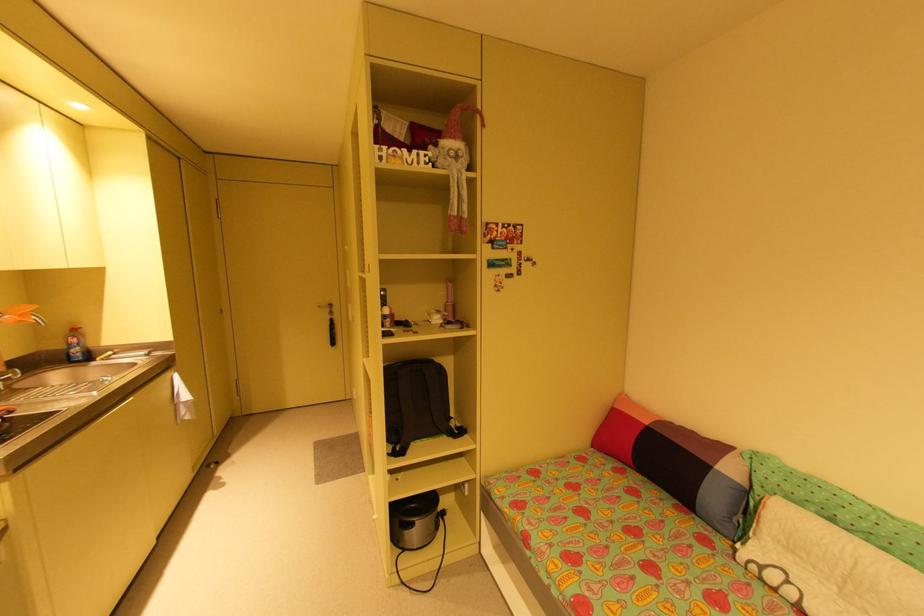
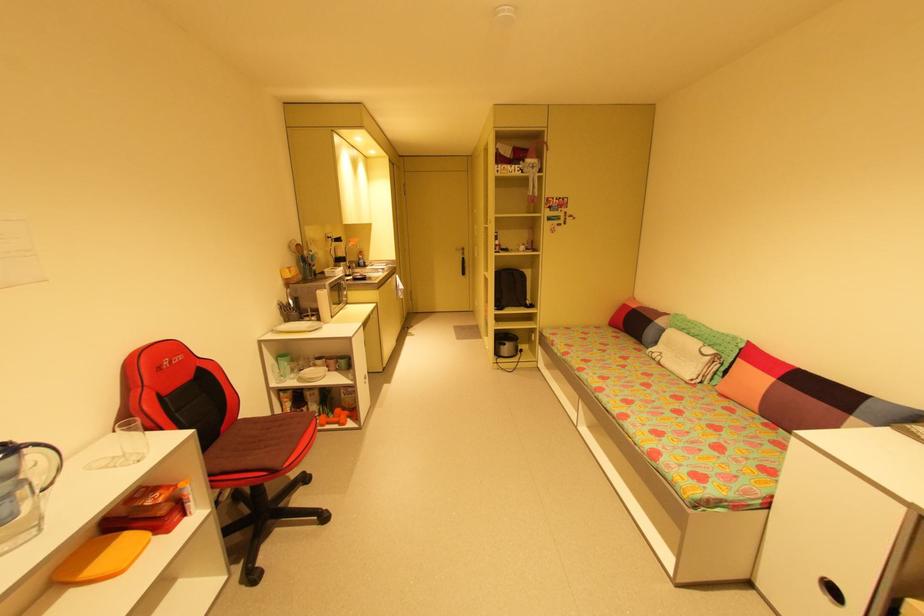
Find the pixel in the second image that matches [453,363] in the first image.

(532, 273)